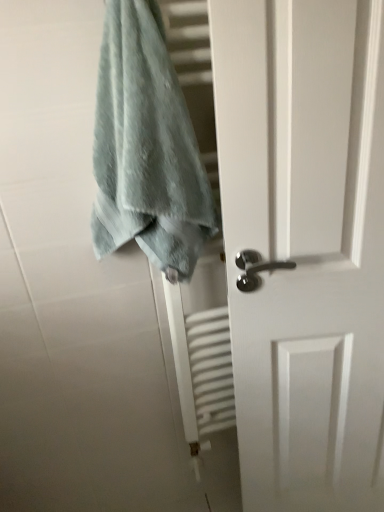
Question: Is soft blue towel at upper left spatially inside white matte door at center, or outside of it?

Choices:
 (A) inside
 (B) outside

Answer: (B)

Question: From a real-world perspective, is soft blue towel at upper left physically located above or below white matte door at center?

Choices:
 (A) above
 (B) below

Answer: (A)

Question: Visually, is soft blue towel at upper left positioned to the left or to the right of white matte door at center?

Choices:
 (A) left
 (B) right

Answer: (A)

Question: In terms of height, does white matte door at center look taller or shorter compared to soft blue towel at upper left?

Choices:
 (A) tall
 (B) short

Answer: (A)

Question: From a real-world perspective, is white matte door at center physically located above or below soft blue towel at upper left?

Choices:
 (A) above
 (B) below

Answer: (B)

Question: Is white matte door at center in front of or behind soft blue towel at upper left in the image?

Choices:
 (A) front
 (B) behind

Answer: (B)

Question: Is white matte door at center to the left or to the right of soft blue towel at upper left in the image?

Choices:
 (A) right
 (B) left

Answer: (A)